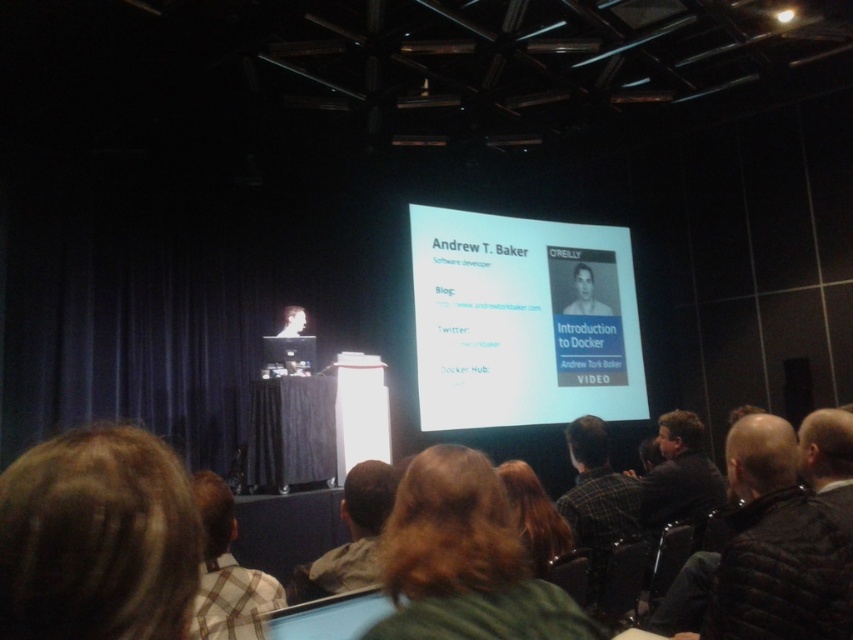
You are an attendee at the presentation. You want to take a photo of the speaker. The speaker is standing at the center of the stage. There is a point marked at coordinate (463, 561) on the speaker. Where is this point located on the speaker?

The point at coordinate (463, 561) is located on the speaker dark brown hair at center.

You are sitting in the audience and want to know which of the two points, point (x=503, y=512) or point (x=554, y=532), is closer to you. Based on the scene, can you determine which one is nearer?

Point (x=503, y=512) is closer to the viewer than point (x=554, y=532).

In the scene, there are two audience members with distinct hair colors. The brown hair at lower left and the blonde hair at lower center. Which audience member has hair of shorter length?

The brown hair at lower left is shorter than the blonde hair at lower center.